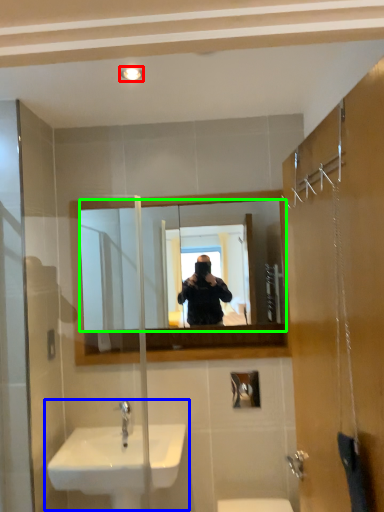
Question: Considering the real-world distances, which object is closest to light fixture (highlighted by a red box)? sink (highlighted by a blue box) or mirror (highlighted by a green box).

Choices:
 (A) sink
 (B) mirror

Answer: (B)